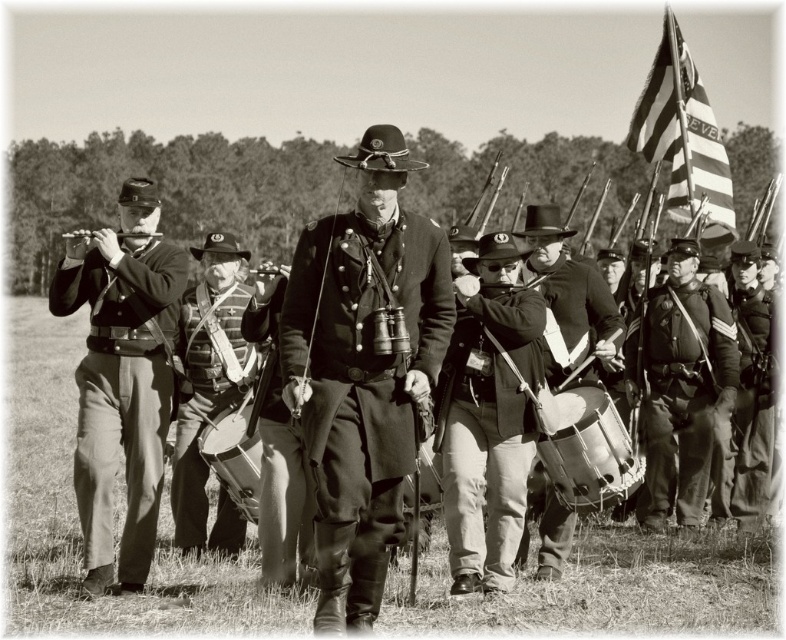
Question: Can you confirm if matte black uniform at center is smaller than rough woolen coat at center?

Choices:
 (A) no
 (B) yes

Answer: (A)

Question: Is striped fabric flag at upper right above dark gray wool pants at right?

Choices:
 (A) yes
 (B) no

Answer: (A)

Question: Which of these objects is positioned farthest from the rough woolen coat at center?

Choices:
 (A) rustic leather jacket at right
 (B) dark gray wool pants at right
 (C) matte black uniform at left

Answer: (B)

Question: Is matte black jacket at center to the right of rough woolen coat at center from the viewer's perspective?

Choices:
 (A) no
 (B) yes

Answer: (B)

Question: Which of the following is the farthest from the observer?

Choices:
 (A) (755, 500)
 (B) (703, 211)
 (C) (156, 540)

Answer: (B)

Question: Which object is positioned closest to the matte black uniform at left?

Choices:
 (A) rough woolen coat at center
 (B) matte leather drum at center
 (C) leather/canvas vest at center

Answer: (C)